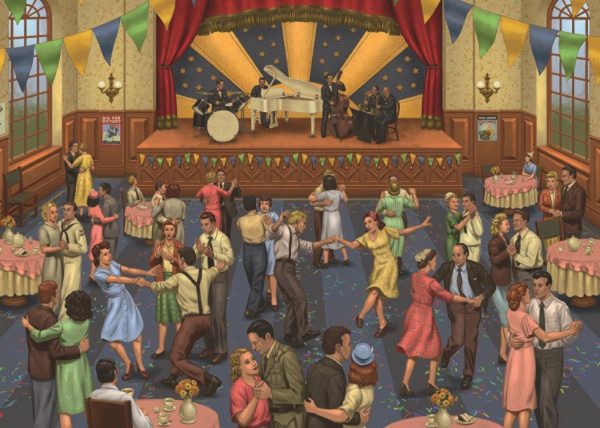
I want to click on window on left, so click(x=27, y=116).